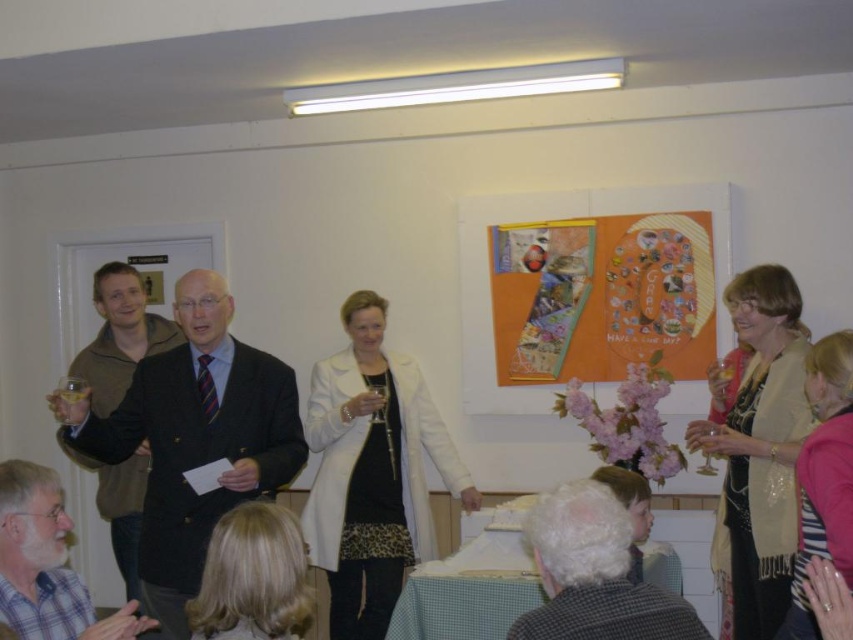
Question: Is pink knitwear at lower right positioned at the back of clear glass wine glass at center?

Choices:
 (A) yes
 (B) no

Answer: (B)

Question: Which of the following is the farthest from the observer?

Choices:
 (A) (97, 333)
 (B) (263, 554)
 (C) (79, 589)
 (D) (316, 545)

Answer: (A)

Question: Estimate the real-world distances between objects in this image. Which object is farther from the blonde hair at lower center?

Choices:
 (A) white matte coat at center
 (B) clear glass wine glass at center
 (C) beige textured scarf at right
 (D) pink knitwear at lower right

Answer: (C)

Question: Which of these objects is positioned farthest from the clear glass wine glass at center?

Choices:
 (A) dark suit at center
 (B) white woolen coat at center
 (C) gray wool sweater at lower center
 (D) pink knitwear at lower right

Answer: (C)

Question: Where is dark suit at center located in relation to gray wool sweater at lower center in the image?

Choices:
 (A) below
 (B) above

Answer: (B)

Question: Is the position of beige textured scarf at right more distant than that of white woolen coat at center?

Choices:
 (A) yes
 (B) no

Answer: (B)